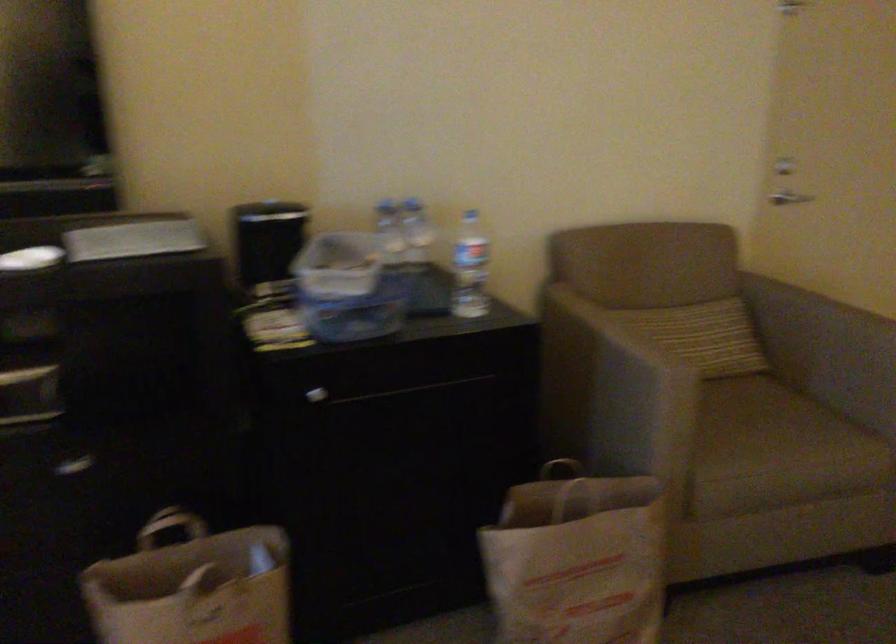
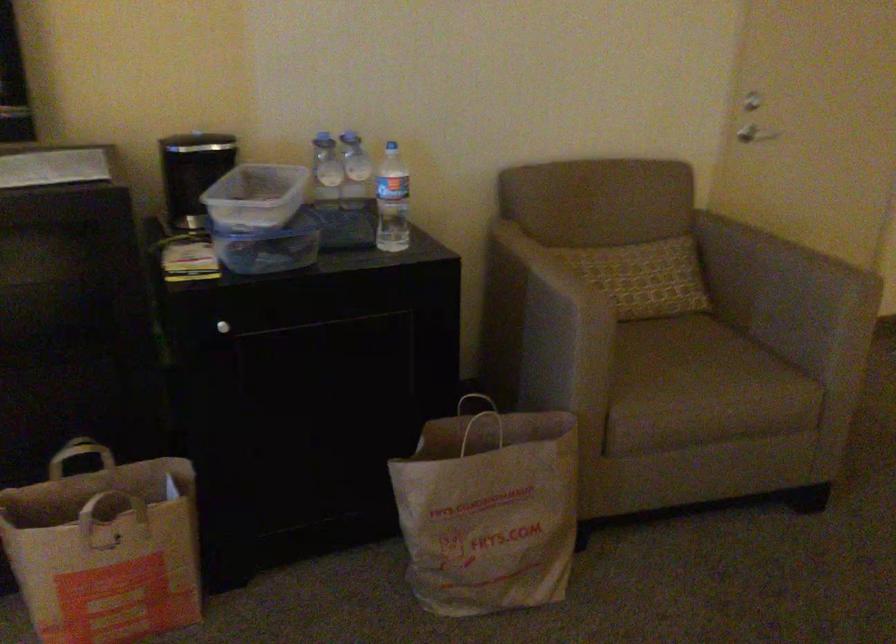
Where in the second image is the point corresponding to (x=336, y=263) from the first image?

(255, 196)